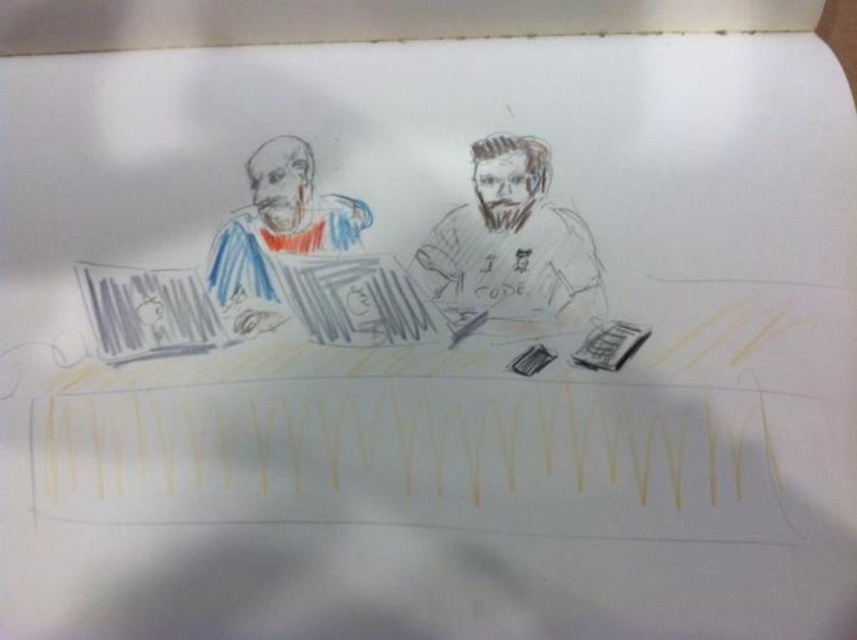
You are an art student analyzing the sketch. You notice two points in the drawing at coordinates point (423, 241) and point (262, 212). Which point is positioned closer to the viewer?

Point (423, 241) is closer to the viewer than point (262, 212).

You are an artist who wants to add a new detail between the gray pencil sketch of man at center and the matte blue and red striped shirt at left. If your pencil can only draw lines up to 6 inches long without lifting it, will you be able to draw a straight line connecting them?

The distance between the gray pencil sketch of man at center and the matte blue and red striped shirt at left is 6.82 inches. Since your pencil can only draw lines up to 6 inches without lifting, you cannot draw a straight line connecting them in one continuous stroke.